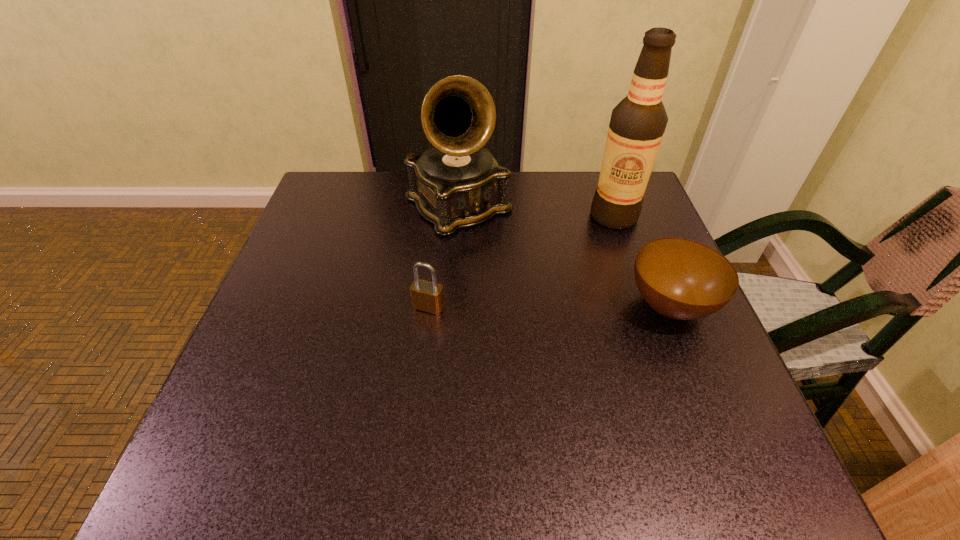
This screenshot has width=960, height=540. Find the location of `free spot on the desktop that is between the padlock and the shortest object and is positioned on the horn of the phonograph record`. free spot on the desktop that is between the padlock and the shortest object and is positioned on the horn of the phonograph record is located at coordinates (555, 306).

You are a GUI agent. You are given a task and a screenshot of the screen. Output one action in this format:
    pyautogui.click(x=<x>, y=<y>)
    Task: Click on the vacant space on the desktop that is between the padlock and the bowl and is positioned on the label of the alcohol
    This screenshot has height=540, width=960.
    Given the screenshot: What is the action you would take?
    pyautogui.click(x=516, y=306)